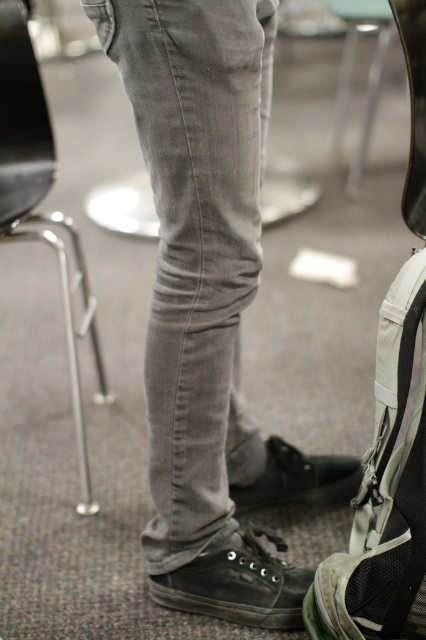
Question: Which of the following is the farthest from the observer?

Choices:
 (A) (356, 468)
 (B) (244, 260)

Answer: (A)

Question: Where is denim pants at center located in relation to dark brown canvas shoe at lower center in the image?

Choices:
 (A) right
 (B) left

Answer: (A)

Question: Which point is farther from the camera taking this photo?

Choices:
 (A) (282, 614)
 (B) (71, 324)
 (C) (149, 172)
 (D) (259, 506)

Answer: (D)

Question: In this image, where is denim pants at center located relative to dark brown canvas shoe at lower center?

Choices:
 (A) above
 (B) below

Answer: (A)

Question: Which object is positioned farthest from the black suede shoe at lower center?

Choices:
 (A) metallic silver chair at left
 (B) dark brown canvas shoe at lower center
 (C) denim pants at center

Answer: (A)

Question: Does denim pants at center have a larger size compared to dark brown canvas shoe at lower center?

Choices:
 (A) no
 (B) yes

Answer: (B)